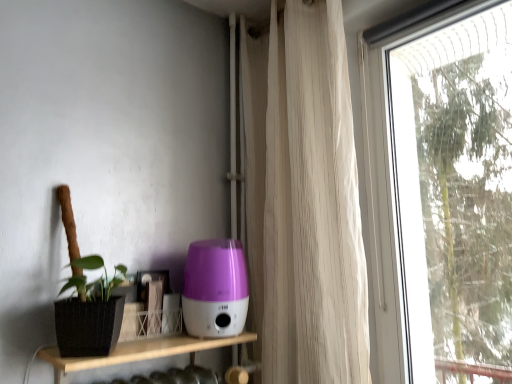
Question: Looking at their shapes, would you say transparent glass window at right is wider or thinner than purple plastic humidifier at center?

Choices:
 (A) thin
 (B) wide

Answer: (A)

Question: Would you say transparent glass window at right is to the left or to the right of purple plastic humidifier at center in the picture?

Choices:
 (A) right
 (B) left

Answer: (A)

Question: Considering the real-world distances, which object is closest to the transparent glass window at right?

Choices:
 (A) purple plastic humidifier at center
 (B) wooden shelf at lower left
 (C) white sheer curtain at right

Answer: (C)

Question: Which object is positioned closest to the white sheer curtain at right?

Choices:
 (A) wooden shelf at lower left
 (B) transparent glass window at right
 (C) purple plastic humidifier at center

Answer: (C)